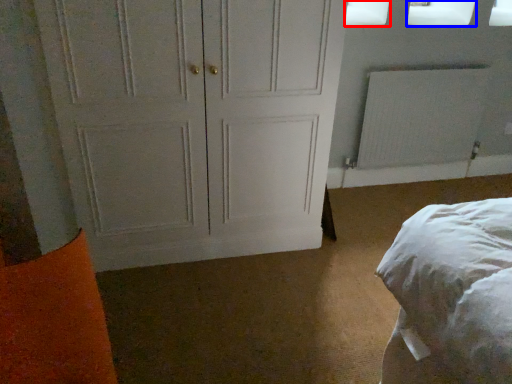
Question: Which point is further to the camera, window screen (highlighted by a red box) or window screen (highlighted by a blue box)?

Choices:
 (A) window screen
 (B) window screen

Answer: (B)